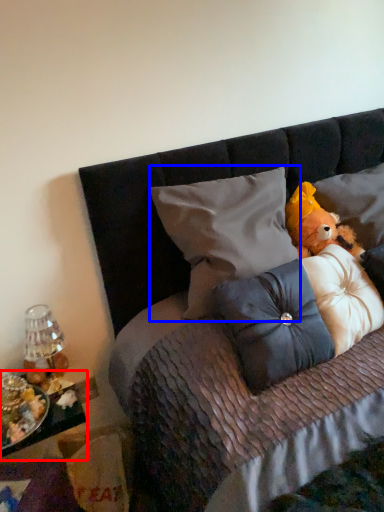
Question: Among these objects, which one is farthest to the camera, table (highlighted by a red box) or pillow (highlighted by a blue box)?

Choices:
 (A) table
 (B) pillow

Answer: (B)